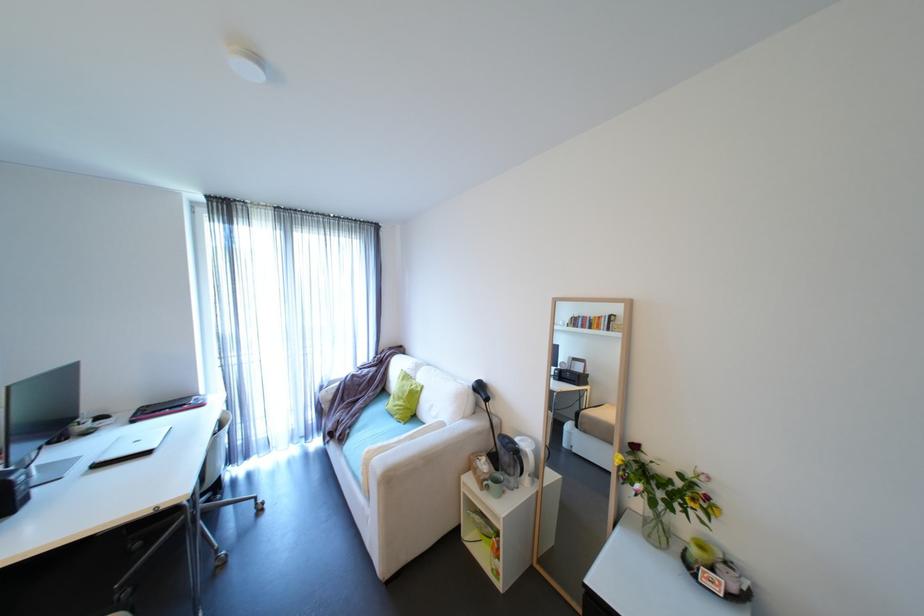
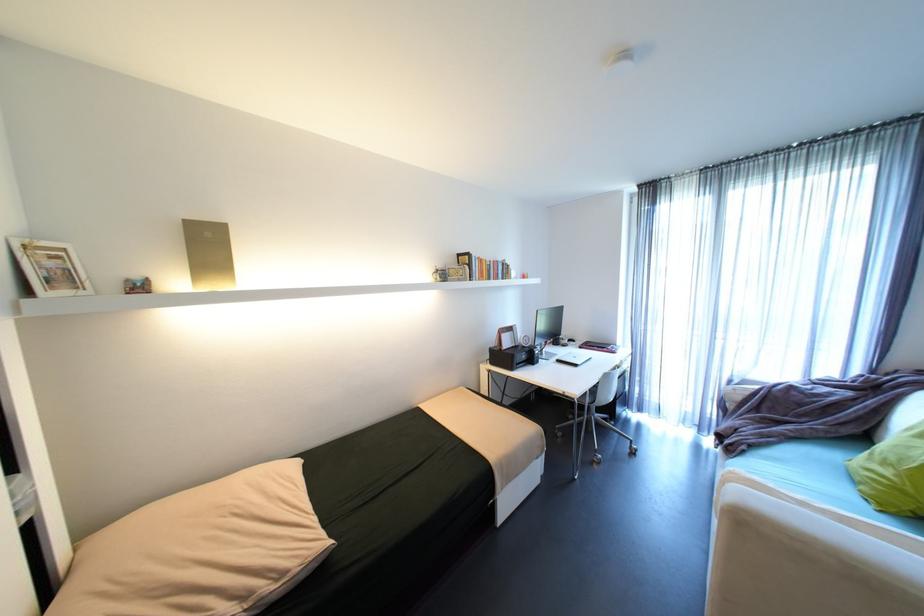
Find the pixel in the second image that matches (x=191, y=405) in the first image.

(612, 347)